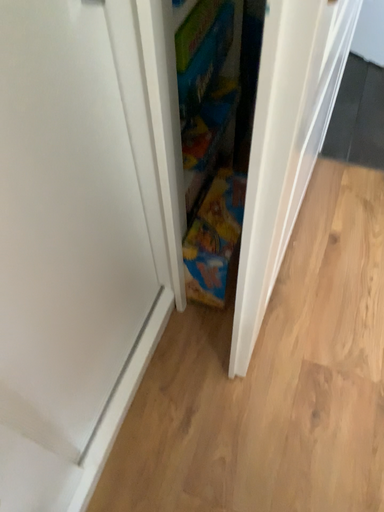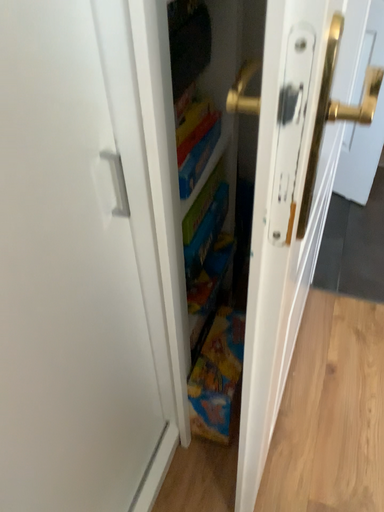
Question: How did the camera likely rotate when shooting the video?

Choices:
 (A) rotated downward
 (B) rotated upward

Answer: (B)